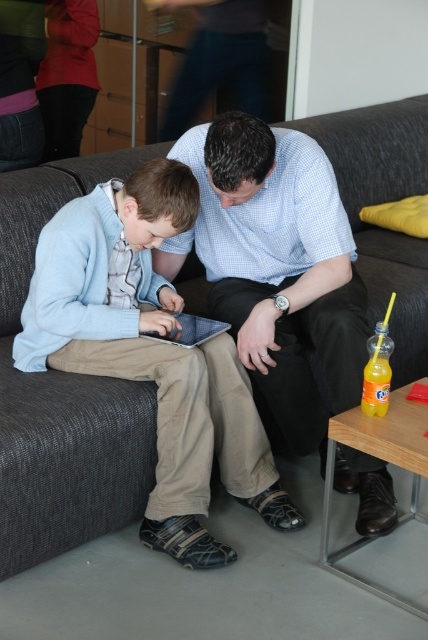
Is light blue sweater at center positioned in front of blue checkered shirt at center?

That is False.

This screenshot has height=640, width=428. What do you see at coordinates (151, 355) in the screenshot?
I see `light blue sweater at center` at bounding box center [151, 355].

Which is in front, point (124, 264) or point (338, 205)?

Point (338, 205)

Locate an element on the screen. The height and width of the screenshot is (640, 428). light blue sweater at center is located at coordinates (151, 355).